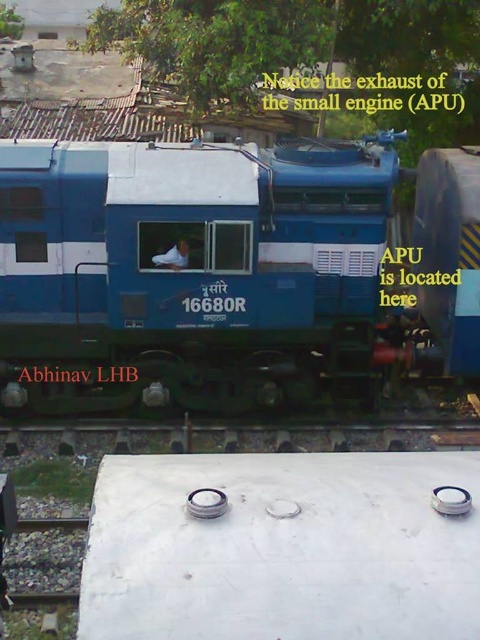
You are standing at the point labeled as point (x=25, y=200) near the train. You want to take a photo of the train using a camera that has a maximum zoom range of 10 meters. Can you capture the entire train in your photo without moving the camera?

The distance between point (x=25, y=200) and the camera is 9.47 meters, which is within the camera maximum zoom range of 10 meters. Therefore, you can capture the entire train in your photo without moving the camera.

You are standing in front of the train and want to locate the two points marked on its surface. Which point, point (368, 365) or point (276, 451), is closer to you?

Point (368, 365) is closer to you because it is further to the viewer than point (276, 451).

You are standing at the point with coordinates (x=228, y=269) in the image of the train. Which object are you located on?

You are located on the blue matte train at center.